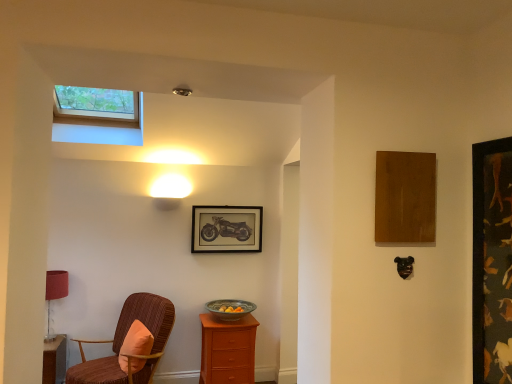
Question: Is orange fabric pillow at lower left a part of velvet brown chair with orange cushion at left?

Choices:
 (A) yes
 (B) no

Answer: (A)

Question: Is velvet brown chair with orange cushion at left positioned with its back to orange fabric pillow at lower left?

Choices:
 (A) yes
 (B) no

Answer: (A)

Question: Does velvet brown chair with orange cushion at left have a lesser width compared to orange fabric pillow at lower left?

Choices:
 (A) yes
 (B) no

Answer: (B)

Question: Is velvet brown chair with orange cushion at left wider than orange fabric pillow at lower left?

Choices:
 (A) no
 (B) yes

Answer: (B)

Question: From a real-world perspective, is velvet brown chair with orange cushion at left on top of orange fabric pillow at lower left?

Choices:
 (A) yes
 (B) no

Answer: (B)

Question: From the image's perspective, is velvet brown chair with orange cushion at left on orange fabric pillow at lower left?

Choices:
 (A) yes
 (B) no

Answer: (B)

Question: Can you confirm if matte black motorcycle at center, marked as the second picture frame in a right-to-left arrangement, is smaller than earthy ceramic bowl at center?

Choices:
 (A) no
 (B) yes

Answer: (B)

Question: Is matte black motorcycle at center, which appears as the first picture frame when viewed from the left, to the right of earthy ceramic bowl at center from the viewer's perspective?

Choices:
 (A) no
 (B) yes

Answer: (A)

Question: From a real-world perspective, is matte black motorcycle at center, which appears as the first picture frame when viewed from the left, positioned under earthy ceramic bowl at center based on gravity?

Choices:
 (A) no
 (B) yes

Answer: (A)

Question: From the image's perspective, does matte black motorcycle at center, acting as the second picture frame starting from the front, appear higher than earthy ceramic bowl at center?

Choices:
 (A) yes
 (B) no

Answer: (A)

Question: Could you tell me if matte black motorcycle at center, acting as the second picture frame starting from the front, is facing earthy ceramic bowl at center?

Choices:
 (A) yes
 (B) no

Answer: (B)

Question: Is matte black motorcycle at center, acting as the second picture frame starting from the front, bigger than earthy ceramic bowl at center?

Choices:
 (A) yes
 (B) no

Answer: (B)

Question: From a real-world perspective, is earthy ceramic bowl at center on velvet brown chair with orange cushion at left?

Choices:
 (A) yes
 (B) no

Answer: (A)